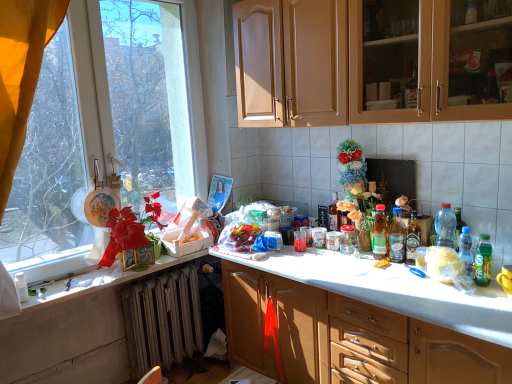
This screenshot has width=512, height=384. What are the coordinates of `vacant space that is to the left of translucent glass bottle at center, marked as the third bottle in a left-to-right arrangement` in the screenshot? It's located at (370, 259).